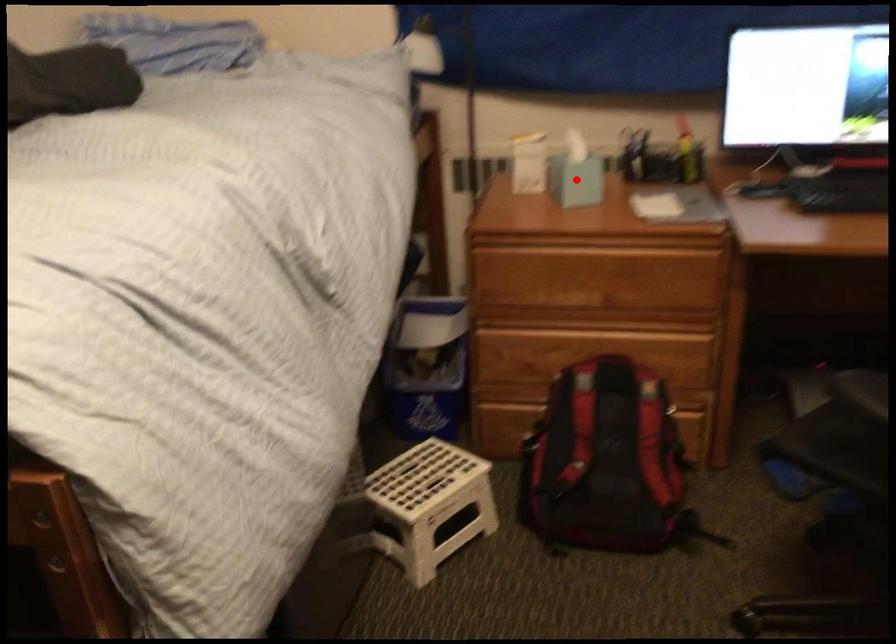
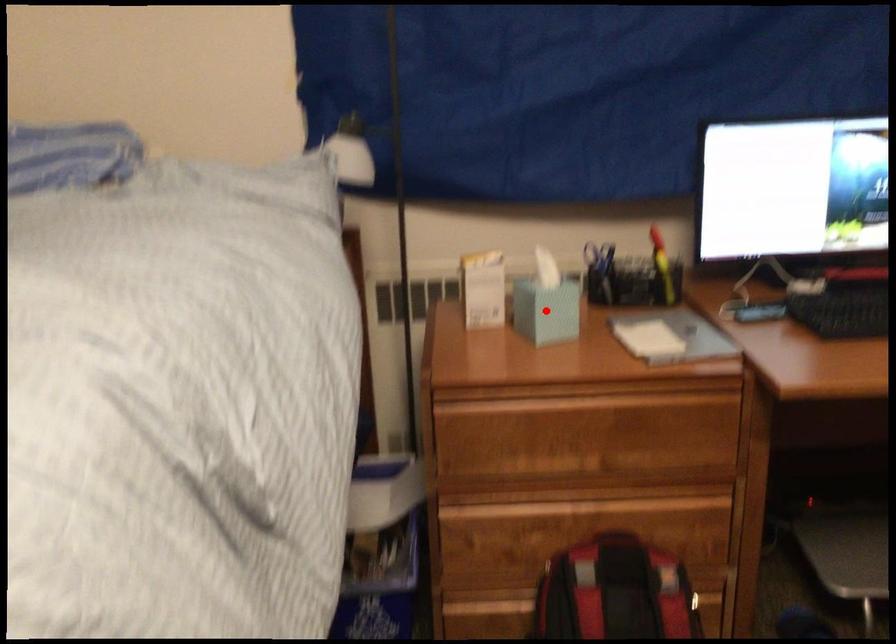
I am providing you with two images of the same scene from different viewpoints. A red point is marked on the first image and another point is marked on the second image. Is the marked point in image1 the same physical position as the marked point in image2?

A: Yes